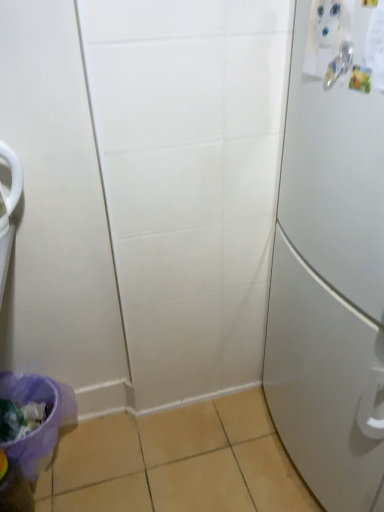
Question: Does purple fabric potty at lower left have a greater width compared to translucent plastic bottle at lower left?

Choices:
 (A) no
 (B) yes

Answer: (B)

Question: Does purple fabric potty at lower left appear on the right side of translucent plastic bottle at lower left?

Choices:
 (A) yes
 (B) no

Answer: (A)

Question: Can you confirm if purple fabric potty at lower left is bigger than translucent plastic bottle at lower left?

Choices:
 (A) no
 (B) yes

Answer: (B)

Question: Does purple fabric potty at lower left have a greater height compared to translucent plastic bottle at lower left?

Choices:
 (A) yes
 (B) no

Answer: (A)

Question: Is purple fabric potty at lower left beside translucent plastic bottle at lower left?

Choices:
 (A) yes
 (B) no

Answer: (B)

Question: Can we say purple fabric potty at lower left lies outside translucent plastic bottle at lower left?

Choices:
 (A) no
 (B) yes

Answer: (B)

Question: From the image's perspective, is white matte refrigerator at right beneath silver metallic door handle at upper right?

Choices:
 (A) no
 (B) yes

Answer: (B)

Question: Is silver metallic door handle at upper right inside white matte refrigerator at right?

Choices:
 (A) no
 (B) yes

Answer: (B)

Question: Can you confirm if white matte refrigerator at right is positioned to the right of silver metallic door handle at upper right?

Choices:
 (A) yes
 (B) no

Answer: (A)

Question: From a real-world perspective, is white matte refrigerator at right located beneath silver metallic door handle at upper right?

Choices:
 (A) yes
 (B) no

Answer: (A)

Question: Considering the relative sizes of white matte refrigerator at right and silver metallic door handle at upper right in the image provided, is white matte refrigerator at right shorter than silver metallic door handle at upper right?

Choices:
 (A) no
 (B) yes

Answer: (A)

Question: Could you tell me if white matte refrigerator at right is facing silver metallic door handle at upper right?

Choices:
 (A) yes
 (B) no

Answer: (A)

Question: Considering the relative sizes of silver metallic door handle at upper right and translucent plastic bottle at lower left in the image provided, is silver metallic door handle at upper right shorter than translucent plastic bottle at lower left?

Choices:
 (A) yes
 (B) no

Answer: (A)